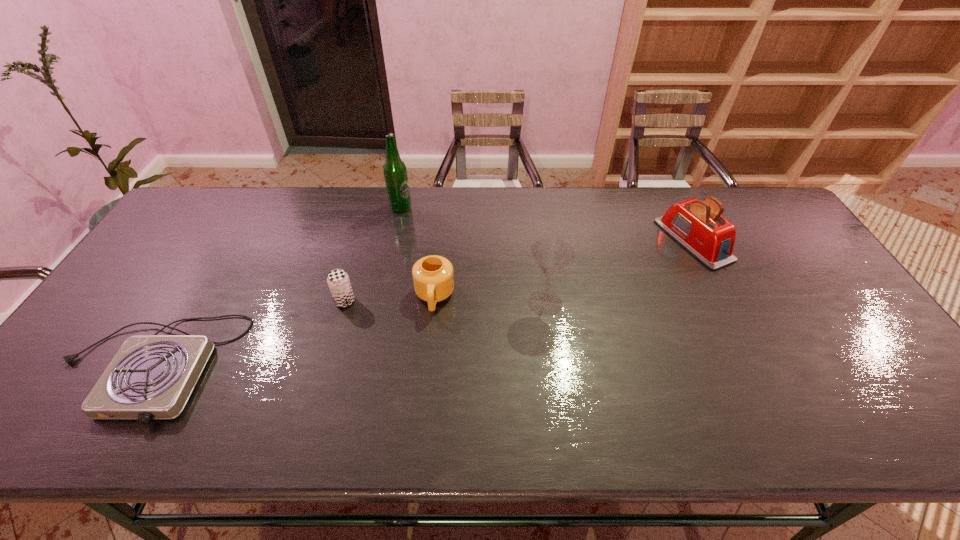
Locate an element on the screen. the tallest object is located at coordinates (395, 172).

Where is `the third object from left to right`? This screenshot has height=540, width=960. the third object from left to right is located at coordinates (395, 172).

I want to click on the fifth shortest object, so click(551, 255).

The height and width of the screenshot is (540, 960). I want to click on the second object from right to left, so click(x=551, y=255).

The image size is (960, 540). I want to click on toaster, so click(x=697, y=225).

The image size is (960, 540). Find the location of `the rightmost object`. the rightmost object is located at coordinates click(x=697, y=225).

Find the location of a particular element. mug is located at coordinates (433, 278).

Find the location of `the fifth object from right to left`. the fifth object from right to left is located at coordinates (338, 281).

Where is `hotplate`? hotplate is located at coordinates (151, 377).

Identify the location of the shortest object. (151, 377).